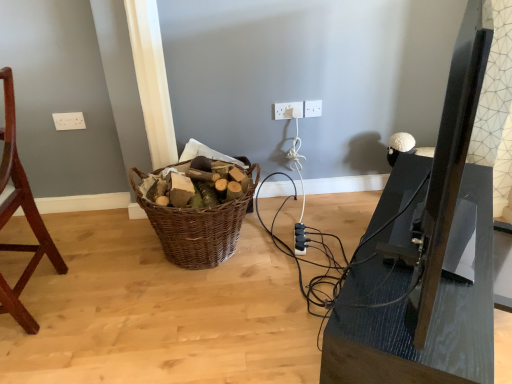
Question: Can you confirm if white plastic electric outlet at center, arranged as the 2th electric outlet when viewed from the right, is shorter than matte black tv stand at right?

Choices:
 (A) no
 (B) yes

Answer: (B)

Question: Is white plastic electric outlet at center, arranged as the 2th electric outlet when viewed from the right, facing towards matte black tv stand at right?

Choices:
 (A) yes
 (B) no

Answer: (A)

Question: Does white plastic electric outlet at center, which is the 2th electric outlet from left to right, have a greater height compared to matte black tv stand at right?

Choices:
 (A) yes
 (B) no

Answer: (B)

Question: Can you confirm if white plastic electric outlet at center, arranged as the 2th electric outlet when viewed from the right, is positioned to the right of matte black tv stand at right?

Choices:
 (A) no
 (B) yes

Answer: (A)

Question: From a real-world perspective, is white plastic electric outlet at center, which is the 2th electric outlet from left to right, beneath matte black tv stand at right?

Choices:
 (A) no
 (B) yes

Answer: (A)

Question: Is mahogany wood chair at left taller or shorter than woven brown basket at center?

Choices:
 (A) tall
 (B) short

Answer: (A)

Question: Which is correct: mahogany wood chair at left is inside woven brown basket at center, or outside of it?

Choices:
 (A) inside
 (B) outside

Answer: (B)

Question: Considering their positions, is mahogany wood chair at left located in front of or behind woven brown basket at center?

Choices:
 (A) behind
 (B) front

Answer: (B)

Question: In the image, is mahogany wood chair at left on the left side or the right side of woven brown basket at center?

Choices:
 (A) right
 (B) left

Answer: (B)

Question: Is mahogany wood chair at left bigger or smaller than white plastic electric outlet at upper center, acting as the 3th electric outlet starting from the left?

Choices:
 (A) big
 (B) small

Answer: (A)

Question: Is mahogany wood chair at left to the left or to the right of white plastic electric outlet at upper center, acting as the 3th electric outlet starting from the left, in the image?

Choices:
 (A) right
 (B) left

Answer: (B)

Question: From the image's perspective, is mahogany wood chair at left above or below white plastic electric outlet at upper center, placed as the first electric outlet when sorted from right to left?

Choices:
 (A) above
 (B) below

Answer: (B)

Question: Which is correct: mahogany wood chair at left is inside white plastic electric outlet at upper center, placed as the first electric outlet when sorted from right to left, or outside of it?

Choices:
 (A) outside
 (B) inside

Answer: (A)

Question: Considering their positions, is woven brown basket at center located in front of or behind matte black tv stand at right?

Choices:
 (A) front
 (B) behind

Answer: (B)

Question: In terms of size, does woven brown basket at center appear bigger or smaller than matte black tv stand at right?

Choices:
 (A) small
 (B) big

Answer: (A)